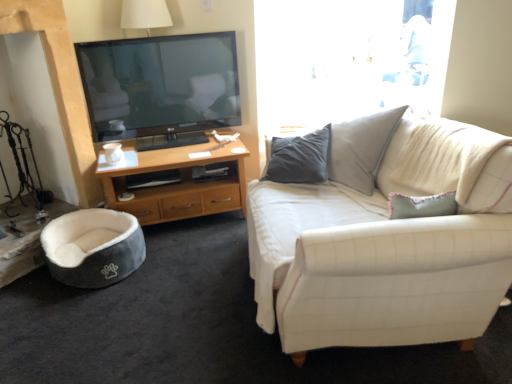
Question: From the image's perspective, is white fabric couch at right under woodendesk at left?

Choices:
 (A) yes
 (B) no

Answer: (A)

Question: From a real-world perspective, is white fabric couch at right under woodendesk at left?

Choices:
 (A) no
 (B) yes

Answer: (A)

Question: From the image's perspective, is white fabric couch at right above woodendesk at left?

Choices:
 (A) no
 (B) yes

Answer: (A)

Question: Does white fabric couch at right have a greater width compared to woodendesk at left?

Choices:
 (A) yes
 (B) no

Answer: (A)

Question: Is white fabric couch at right bigger than woodendesk at left?

Choices:
 (A) yes
 (B) no

Answer: (A)

Question: Looking at their shapes, would you say velvet grey bean bag at lower left is wider or thinner than white matte coffee cup at lower left?

Choices:
 (A) thin
 (B) wide

Answer: (B)

Question: Does point (119, 235) appear closer or farther from the camera than point (116, 155)?

Choices:
 (A) closer
 (B) farther

Answer: (A)

Question: From their relative heights in the image, would you say velvet grey bean bag at lower left is taller or shorter than white matte coffee cup at lower left?

Choices:
 (A) tall
 (B) short

Answer: (A)

Question: Is velvet grey bean bag at lower left to the left or to the right of white matte coffee cup at lower left in the image?

Choices:
 (A) left
 (B) right

Answer: (A)

Question: Does point (106, 160) appear closer or farther from the camera than point (57, 274)?

Choices:
 (A) closer
 (B) farther

Answer: (B)

Question: From the image's perspective, is white matte coffee cup at lower left above or below velvet grey bean bag at lower left?

Choices:
 (A) below
 (B) above

Answer: (B)

Question: From a real-world perspective, is white matte coffee cup at lower left above or below velvet grey bean bag at lower left?

Choices:
 (A) above
 (B) below

Answer: (A)

Question: Is white matte coffee cup at lower left taller or shorter than velvet grey bean bag at lower left?

Choices:
 (A) short
 (B) tall

Answer: (A)

Question: Is white fabric couch at right in front of or behind velvet grey bean bag at lower left in the image?

Choices:
 (A) behind
 (B) front

Answer: (B)

Question: Is white fabric couch at right inside the boundaries of velvet grey bean bag at lower left, or outside?

Choices:
 (A) inside
 (B) outside

Answer: (B)